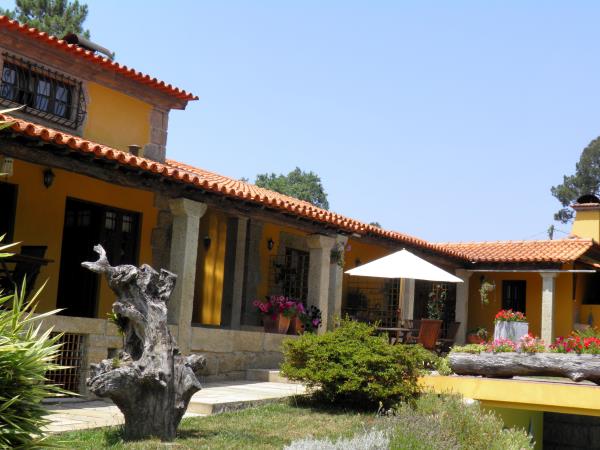
The width and height of the screenshot is (600, 450). I want to click on windows, so click(x=57, y=104), click(x=14, y=87), click(x=127, y=227), click(x=111, y=227), click(x=302, y=271), click(x=514, y=298), click(x=592, y=297).